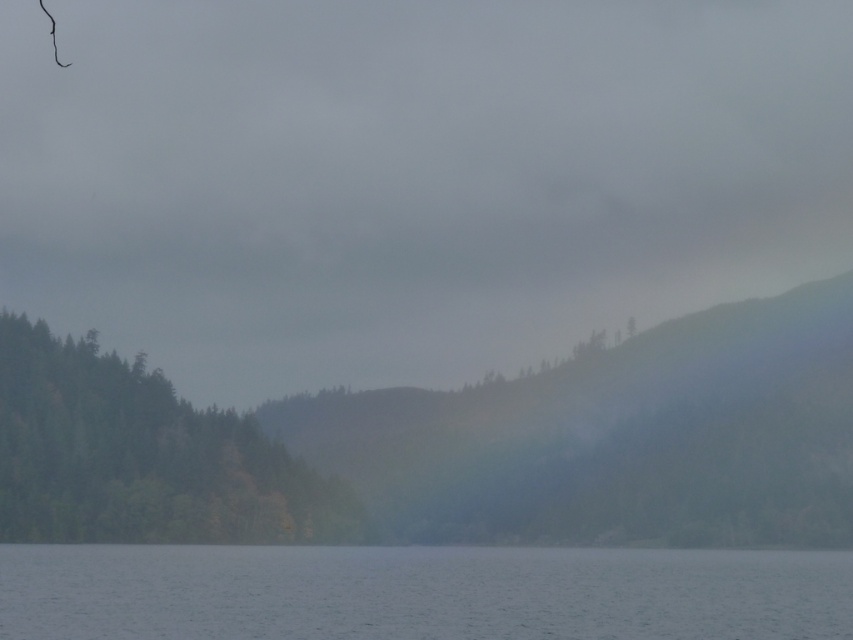
Question: Where is transparent water at lower center located in relation to green matte forest at left in the image?

Choices:
 (A) left
 (B) right

Answer: (B)

Question: Can you confirm if transparent water at lower center is positioned to the left of green matte forest at left?

Choices:
 (A) no
 (B) yes

Answer: (A)

Question: Can you confirm if transparent water at lower center is wider than green matte forest at left?

Choices:
 (A) no
 (B) yes

Answer: (B)